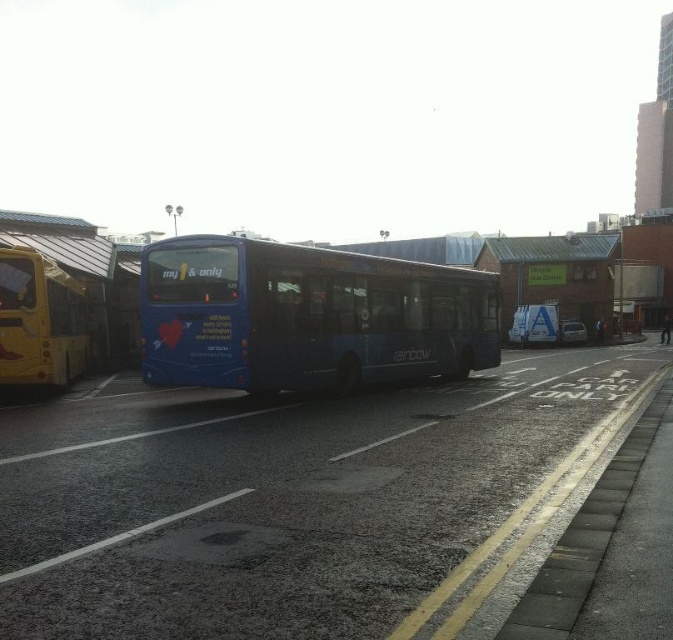
You are a photographer standing at the camera position. The blue matte bus at center is your subject. To capture the bus clearly, you need to be at least 10 meters away. Can you take the photo from your current position?

The blue matte bus at center and camera are 13.02 meters apart, so yes, you can take the photo from your current position since the distance is more than the required 10 meters.

You are standing at point (306, 316) on the urban street. What object is located exactly at your current position?

The blue matte bus at center is located exactly at point (306, 316).

You are a photographer standing on the sidewalk trying to capture a clear shot of the blue bus in the center. There are two points of interest marked on your camera screen at coordinates point (246, 266) and point (57, 344). Which point should you focus on to ensure it appears larger in your photo?

Point (246, 266) is closer to the camera than point (57, 344), so focusing on point (246, 266) will make it appear larger in the photo.